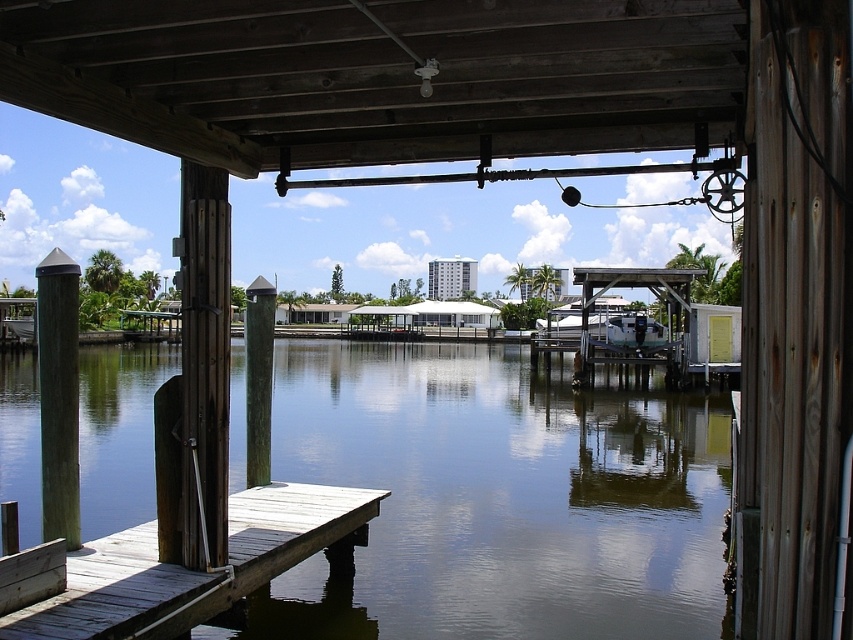
Question: Which point appears closest to the camera in this image?

Choices:
 (A) pyautogui.click(x=227, y=257)
 (B) pyautogui.click(x=170, y=632)
 (C) pyautogui.click(x=70, y=442)
 (D) pyautogui.click(x=474, y=346)

Answer: (B)

Question: Is green wood post at left to the right of green painted wood post at center from the viewer's perspective?

Choices:
 (A) yes
 (B) no

Answer: (B)

Question: In this image, where is greenish-gray water at center located relative to green painted wood post at center?

Choices:
 (A) below
 (B) above

Answer: (A)

Question: Which point appears closest to the camera in this image?

Choices:
 (A) (57, 465)
 (B) (184, 493)
 (C) (144, 609)
 (D) (125, 470)

Answer: (C)

Question: Which of the following is the closest to the observer?

Choices:
 (A) (248, 540)
 (B) (73, 508)
 (C) (248, 416)
 (D) (280, 349)

Answer: (B)

Question: From the image, what is the correct spatial relationship of brown wood post at center in relation to green wood post at left?

Choices:
 (A) left
 (B) right

Answer: (B)